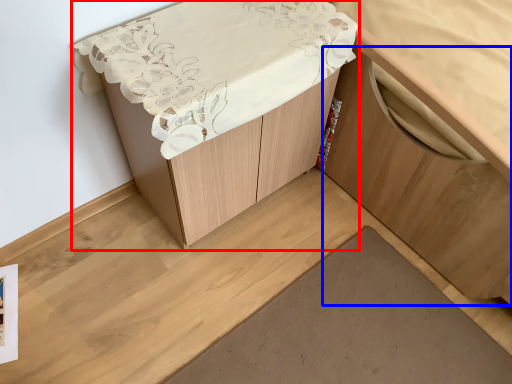
Question: Which of the following is the farthest to the observer, furniture (highlighted by a red box) or cabinetry (highlighted by a blue box)?

Choices:
 (A) furniture
 (B) cabinetry

Answer: (A)